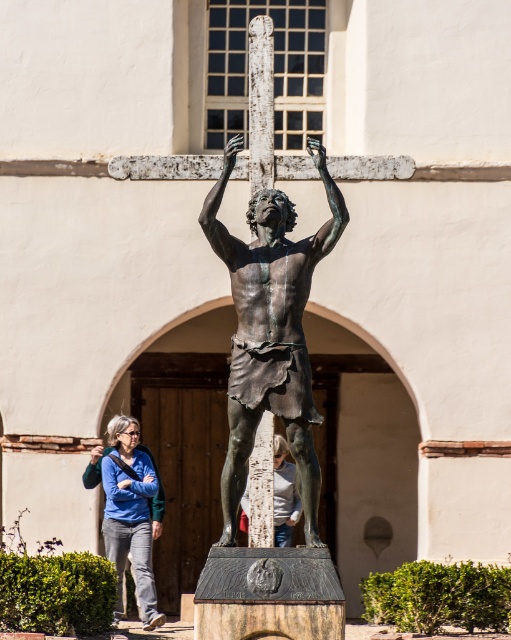
Question: Observing the image, what is the correct spatial positioning of bronze statue at center in reference to white cotton shirt at center?

Choices:
 (A) below
 (B) above

Answer: (B)

Question: Observing the image, what is the correct spatial positioning of bronze statue at center in reference to white cotton shirt at center?

Choices:
 (A) left
 (B) right

Answer: (B)

Question: Which object appears farthest from the camera in this image?

Choices:
 (A) blue denim jeans at lower left
 (B) white cotton shirt at center
 (C) bronze statue at center

Answer: (A)

Question: Which object appears farthest from the camera in this image?

Choices:
 (A) white cotton shirt at center
 (B) bronze statue at center
 (C) blue denim jeans at lower left

Answer: (C)

Question: Which point appears closest to the camera in this image?

Choices:
 (A) (310, 445)
 (B) (113, 516)
 (C) (247, 525)

Answer: (A)

Question: Can you confirm if bronze statue at center is positioned below white cotton shirt at center?

Choices:
 (A) yes
 (B) no

Answer: (B)